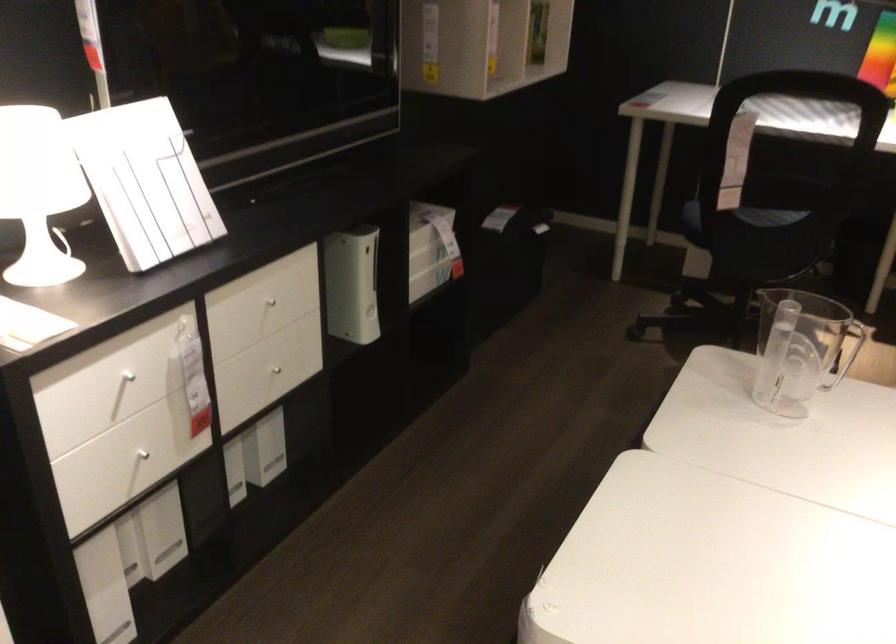
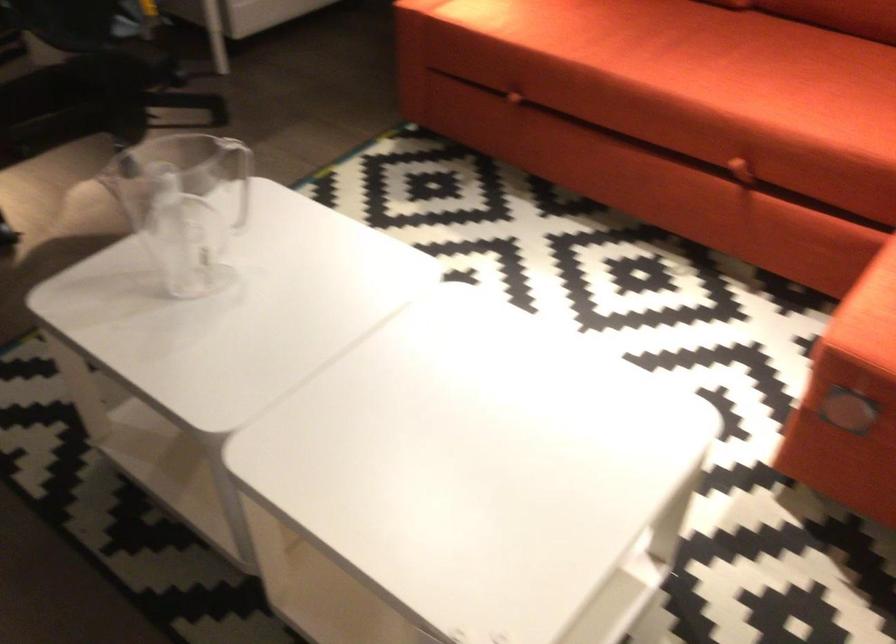
Based on the photo, based on the continuous images, in which direction is the camera rotating?

The rotation direction of the camera is right-down.